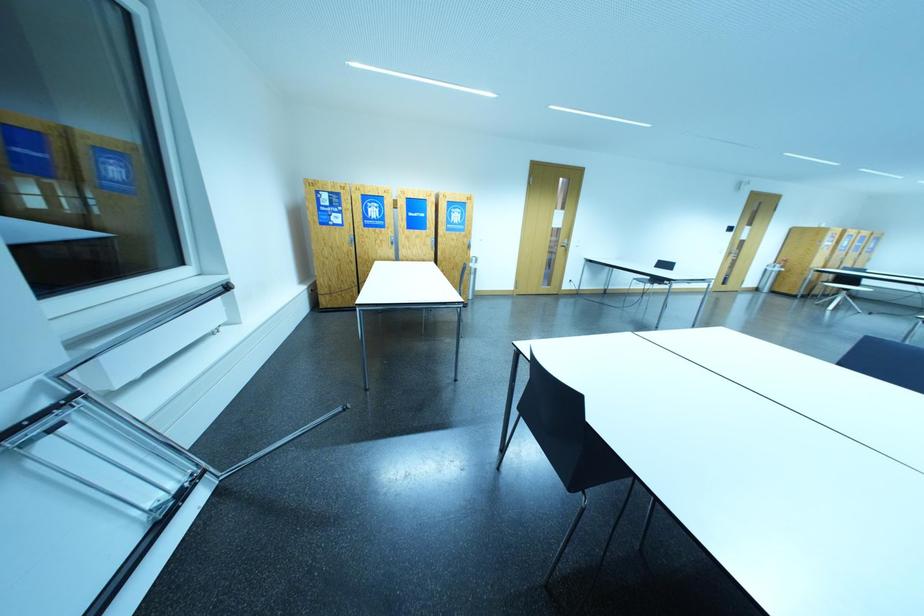
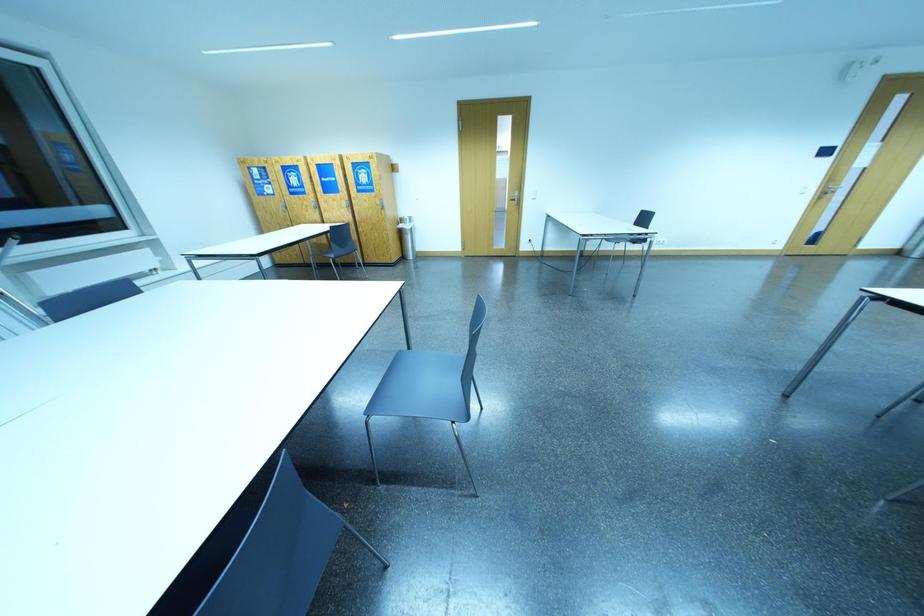
Question: Which direction would the cameraman need to move to produce the second image? Reply with the corresponding letter.

Choices:
 (A) Left
 (B) Right
 (C) Forward
 (D) Backward

Answer: (B)